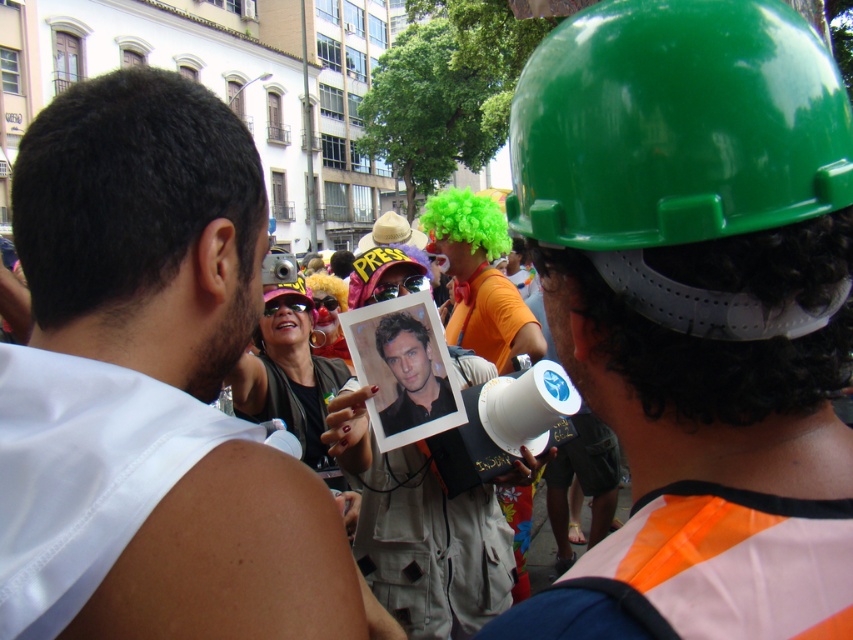
You are a photographer at the event and want to capture both the matte black photo at center and the green hard hat at center in a single frame. Which object should you focus on first to ensure both are in focus?

The matte black photo at center is taller than the green hard hat at center, so you should focus on the matte black photo at center first to ensure depth of field accommodates both objects.

You are a photographer at the event and want to capture a clear shot of both the matte black photo at center and the green hard hat at center. Since you can only focus on one object at a time, which one should you focus on to ensure it appears sharp in the photo?

You should focus on the matte black photo at center because it is closer to the viewer than the green hard hat at center, so focusing on it will keep it sharp while the other may appear slightly blurred.

You are standing at the back of the crowd and want to see the speaker better. Which object, the green hard hat at right or the smooth black shirt at center, is taller and would block your view more?

The green hard hat at right is much taller than the smooth black shirt at center, so it would block your view more.